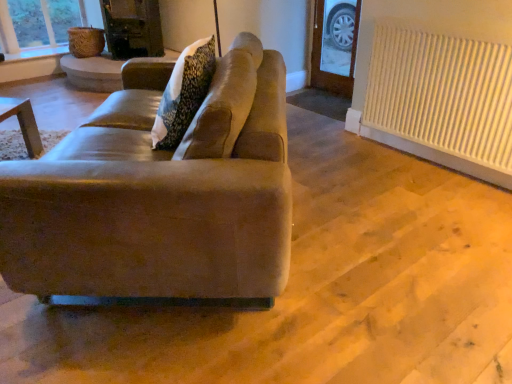
Question: Should I look upward or downward to see suede-like beige couch at center?

Choices:
 (A) down
 (B) up

Answer: (B)

Question: Considering the relative sizes of white ribbed radiator at right and suede-like beige couch at center in the image provided, is white ribbed radiator at right wider than suede-like beige couch at center?

Choices:
 (A) yes
 (B) no

Answer: (B)

Question: Would you say white ribbed radiator at right contains suede-like beige couch at center?

Choices:
 (A) no
 (B) yes

Answer: (A)

Question: Considering the relative positions of white ribbed radiator at right and suede-like beige couch at center in the image provided, is white ribbed radiator at right in front of suede-like beige couch at center?

Choices:
 (A) no
 (B) yes

Answer: (A)

Question: Is white ribbed radiator at right smaller than suede-like beige couch at center?

Choices:
 (A) yes
 (B) no

Answer: (A)

Question: Does white ribbed radiator at right have a lesser width compared to suede-like beige couch at center?

Choices:
 (A) no
 (B) yes

Answer: (B)

Question: Can you confirm if white ribbed radiator at right is shorter than suede-like beige couch at center?

Choices:
 (A) no
 (B) yes

Answer: (A)

Question: Is suede-like beige couch at center oriented away from white ribbed radiator at right?

Choices:
 (A) no
 (B) yes

Answer: (B)

Question: Does suede-like beige couch at center appear on the right side of white ribbed radiator at right?

Choices:
 (A) no
 (B) yes

Answer: (A)

Question: Considering the relative positions of suede-like beige couch at center and white ribbed radiator at right in the image provided, is suede-like beige couch at center to the left of white ribbed radiator at right from the viewer's perspective?

Choices:
 (A) yes
 (B) no

Answer: (A)

Question: Is suede-like beige couch at center shorter than white ribbed radiator at right?

Choices:
 (A) yes
 (B) no

Answer: (A)

Question: Is suede-like beige couch at center outside of white ribbed radiator at right?

Choices:
 (A) no
 (B) yes

Answer: (B)

Question: Does suede-like beige couch at center have a lesser width compared to white ribbed radiator at right?

Choices:
 (A) yes
 (B) no

Answer: (B)

Question: In terms of width, does white ribbed radiator at right look wider or thinner when compared to suede-like beige couch at center?

Choices:
 (A) wide
 (B) thin

Answer: (B)